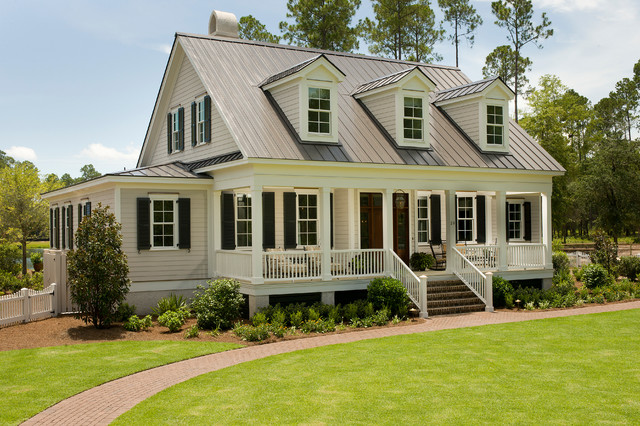
Identify the location of columns. (255, 241), (326, 238), (385, 230), (452, 233), (500, 223), (546, 231).